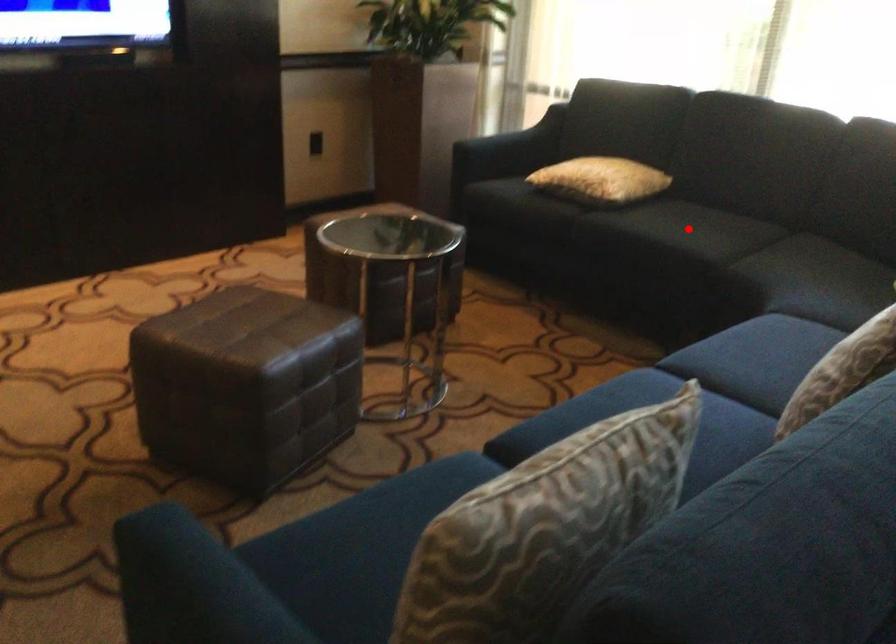
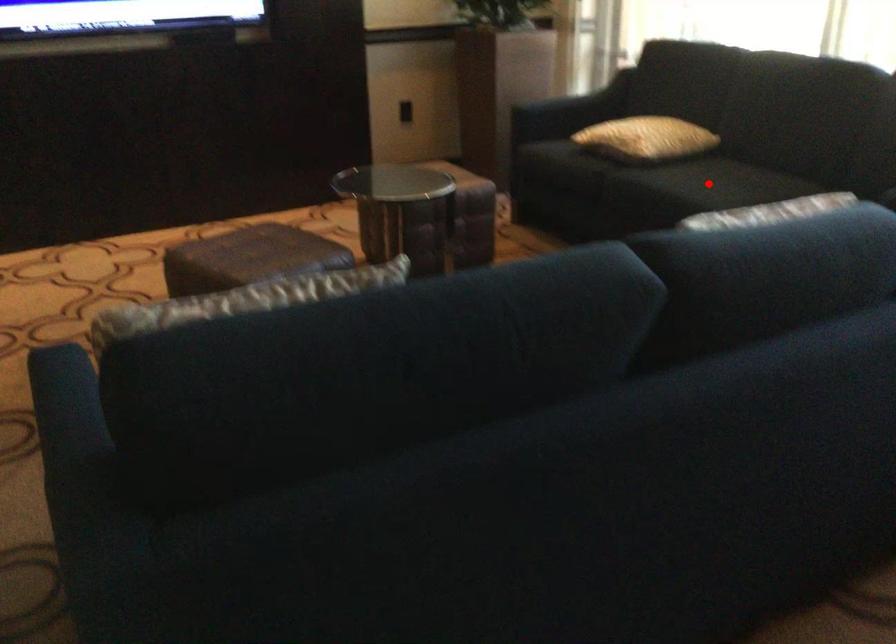
I am providing you with two images of the same scene from different viewpoints. A red point is marked on the first image and another point is marked on the second image. Is the marked point in image1 the same physical position as the marked point in image2?

Yes